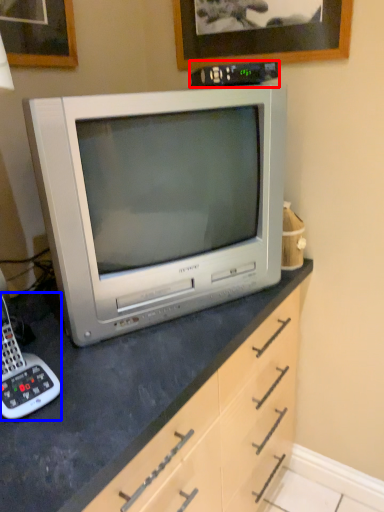
Question: Which object is further to the camera taking this photo, appliance (highlighted by a red box) or corded phone (highlighted by a blue box)?

Choices:
 (A) appliance
 (B) corded phone

Answer: (A)